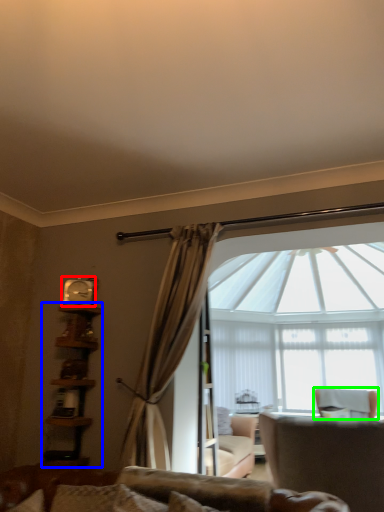
Question: Estimate the real-world distances between objects in this image. Which object is farther from clock (highlighted by a red box), bookshelf (highlighted by a blue box) or chair (highlighted by a green box)?

Choices:
 (A) bookshelf
 (B) chair

Answer: (B)